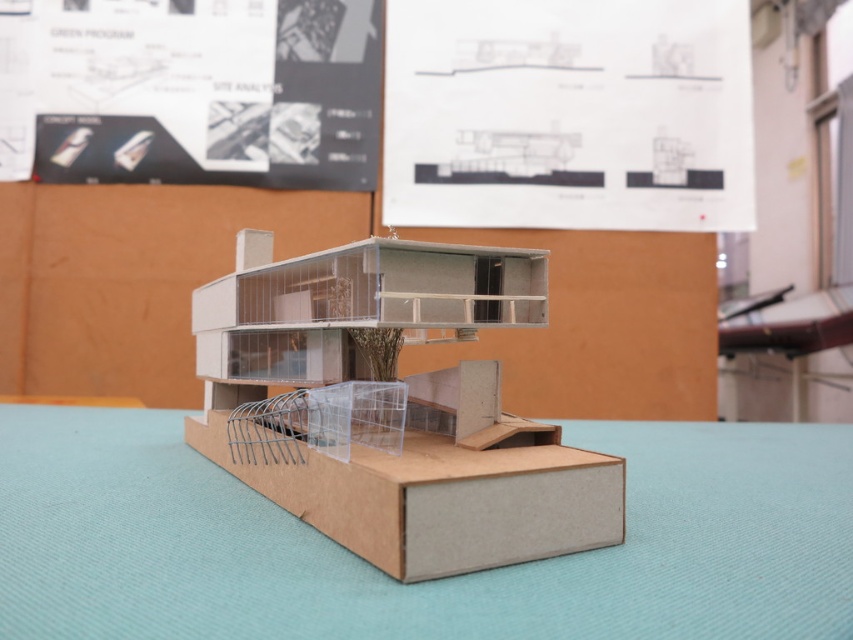
Question: Considering the relative positions of brown cardboard table at center and cardboard box at center in the image provided, where is brown cardboard table at center located with respect to cardboard box at center?

Choices:
 (A) left
 (B) right

Answer: (B)

Question: Among these objects, which one is farthest from the camera?

Choices:
 (A) brown cardboard box at lower center
 (B) cardboard box at center

Answer: (B)

Question: Estimate the real-world distances between objects in this image. Which object is farther from the brown cardboard box at lower center?

Choices:
 (A) cardboard box at center
 (B) brown cardboard table at center

Answer: (B)

Question: Is cardboard box at center smaller than brown cardboard box at lower center?

Choices:
 (A) no
 (B) yes

Answer: (A)

Question: Is cardboard box at center thinner than brown cardboard box at lower center?

Choices:
 (A) no
 (B) yes

Answer: (B)

Question: Which point is farther to the camera?

Choices:
 (A) brown cardboard table at center
 (B) cardboard box at center
 (C) brown cardboard box at lower center

Answer: (B)